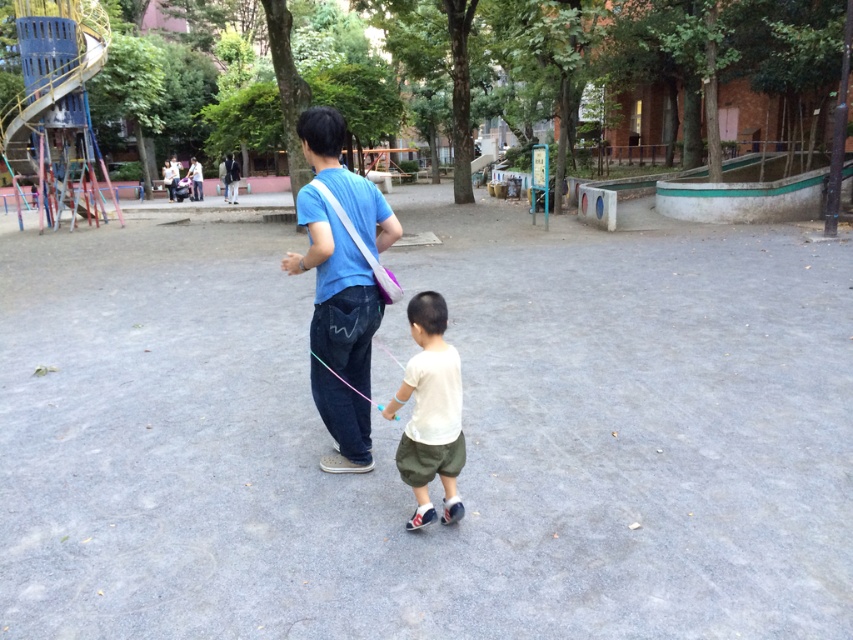
Which is above, blue cotton t-shirt at center or light beige cotton shorts at center?

blue cotton t-shirt at center is above.

Is blue cotton t-shirt at center below light beige cotton shorts at center?

Incorrect, blue cotton t-shirt at center is not positioned below light beige cotton shorts at center.

Where is `blue cotton t-shirt at center`? Image resolution: width=853 pixels, height=640 pixels. blue cotton t-shirt at center is located at coordinates (337, 291).